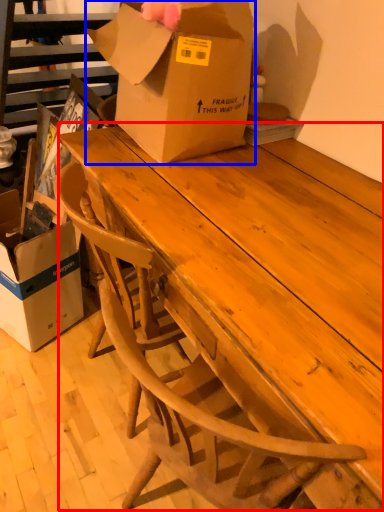
Question: Which object appears farthest to the camera in this image, table (highlighted by a red box) or box (highlighted by a blue box)?

Choices:
 (A) table
 (B) box

Answer: (B)